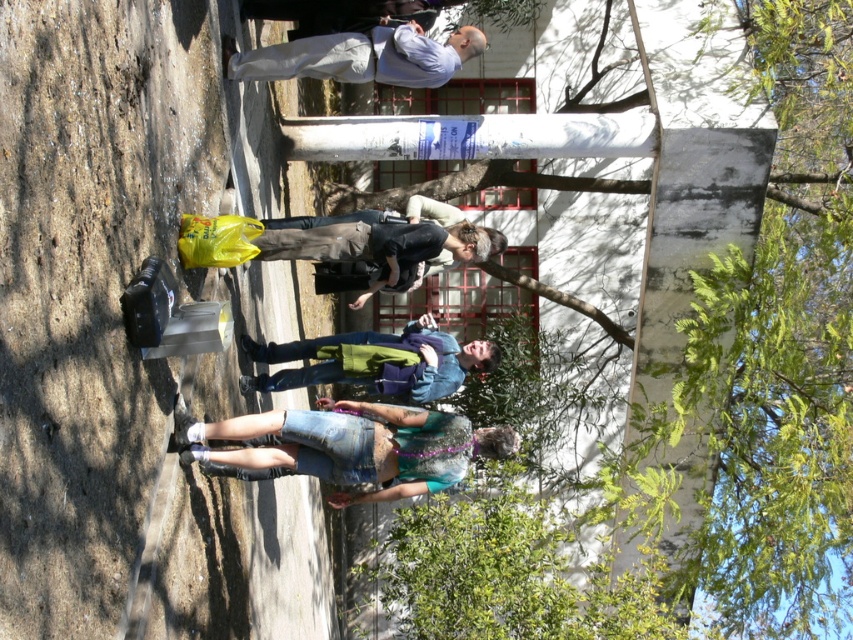
Who is more forward, (428,422) or (409,333)?

Point (428,422) is more forward.

Does point (276, 445) come in front of point (480, 340)?

Yes, point (276, 445) is in front of point (480, 340).

This screenshot has height=640, width=853. What are the coordinates of `denim shorts at lower center` in the screenshot? It's located at (357, 445).